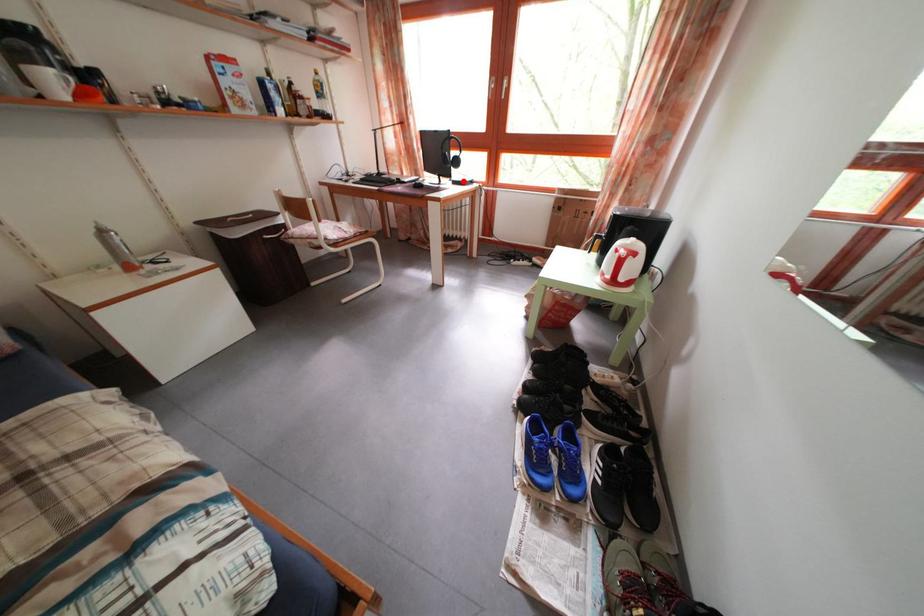
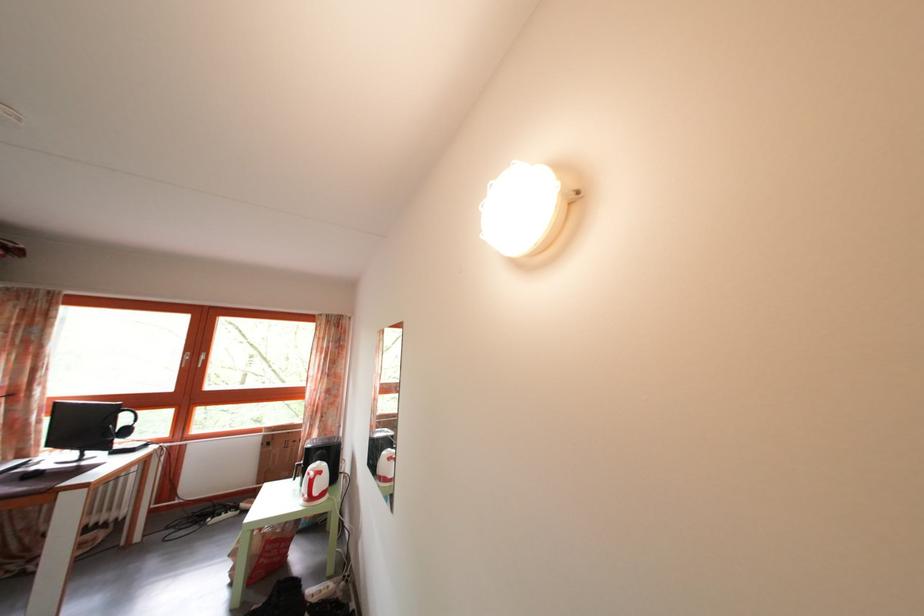
The point at the highlighted location is marked in the first image. Where is the corresponding point in the second image?

(128, 451)